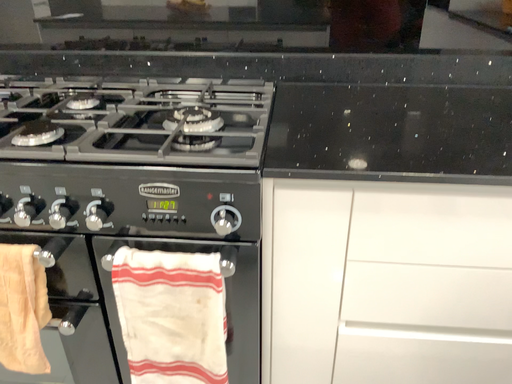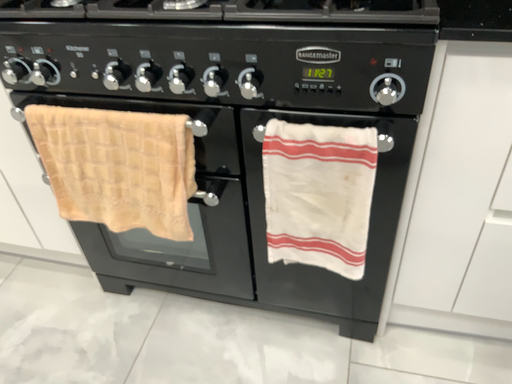
Question: Which way did the camera rotate in the video?

Choices:
 (A) rotated right
 (B) rotated left

Answer: (B)